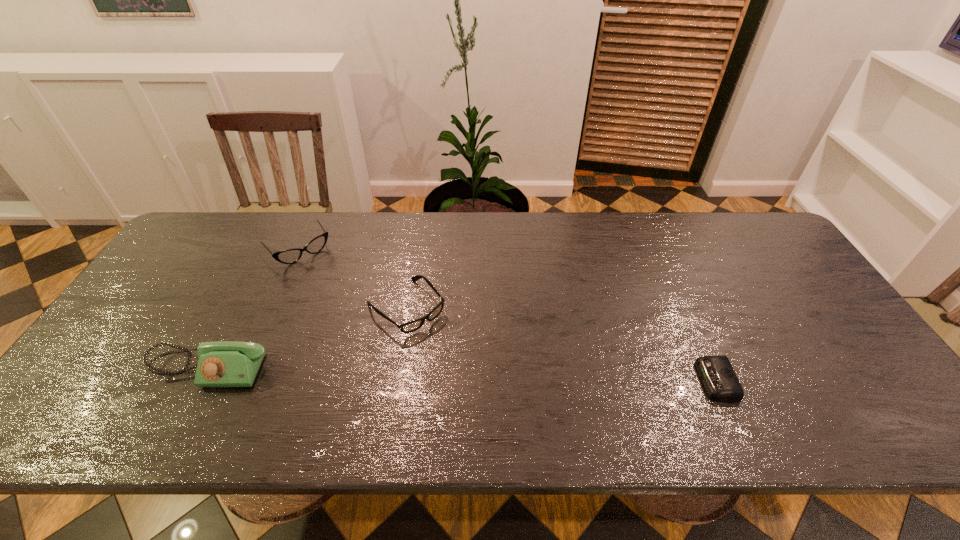
Where is `the tallest object`? The height and width of the screenshot is (540, 960). the tallest object is located at coordinates (224, 363).

Identify the location of alarm clock. The height and width of the screenshot is (540, 960). (716, 372).

I want to click on the shortest object, so 716,372.

Locate an element on the screen. the second shortest object is located at coordinates (414, 325).

Locate an element on the screen. The width and height of the screenshot is (960, 540). the second object from right to left is located at coordinates (414, 325).

Locate an element on the screen. the left spectacles is located at coordinates pyautogui.click(x=289, y=256).

Locate an element on the screen. The width and height of the screenshot is (960, 540). the farthest object is located at coordinates (289, 256).

This screenshot has height=540, width=960. I want to click on free space located on the display of the alarm clock, so click(x=578, y=381).

You are a GUI agent. You are given a task and a screenshot of the screen. Output one action in this format:
    pyautogui.click(x=<x>, y=<y>)
    Task: Click on the vacant space positioned 0.120m on the display of the alarm clock
    
    Given the screenshot: What is the action you would take?
    pyautogui.click(x=650, y=381)

The image size is (960, 540). I want to click on free space located 0.110m on the display of the alarm clock, so click(655, 381).